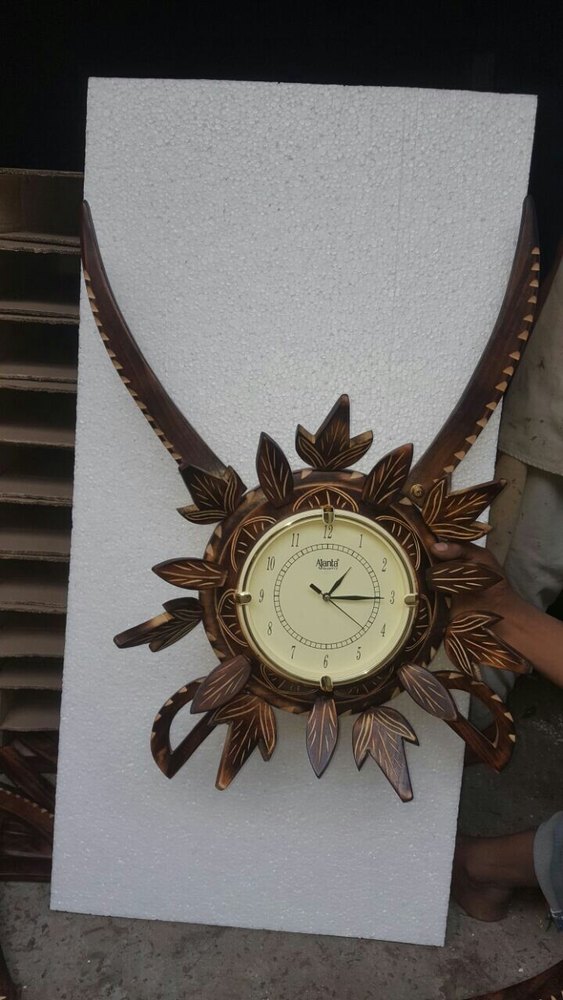
Where is `shelves`? The height and width of the screenshot is (1000, 563). shelves is located at coordinates (21, 627), (39, 480).